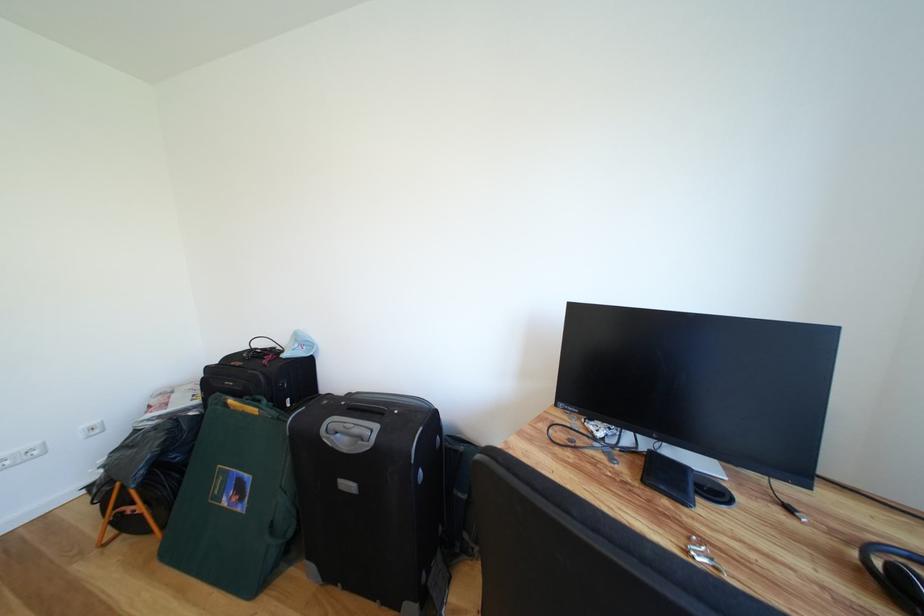
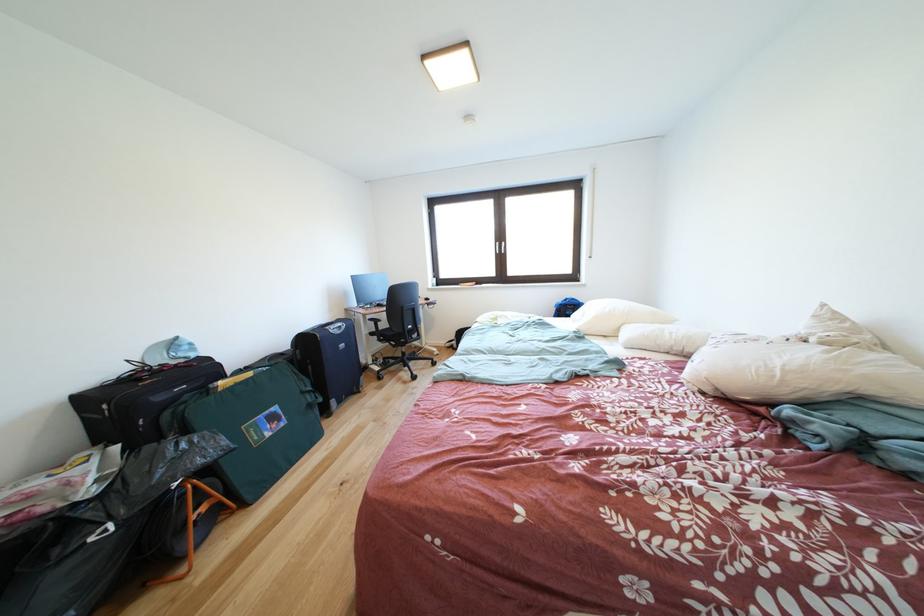
Locate, in the second image, the point that corresponds to [274,370] in the first image.

(200, 371)